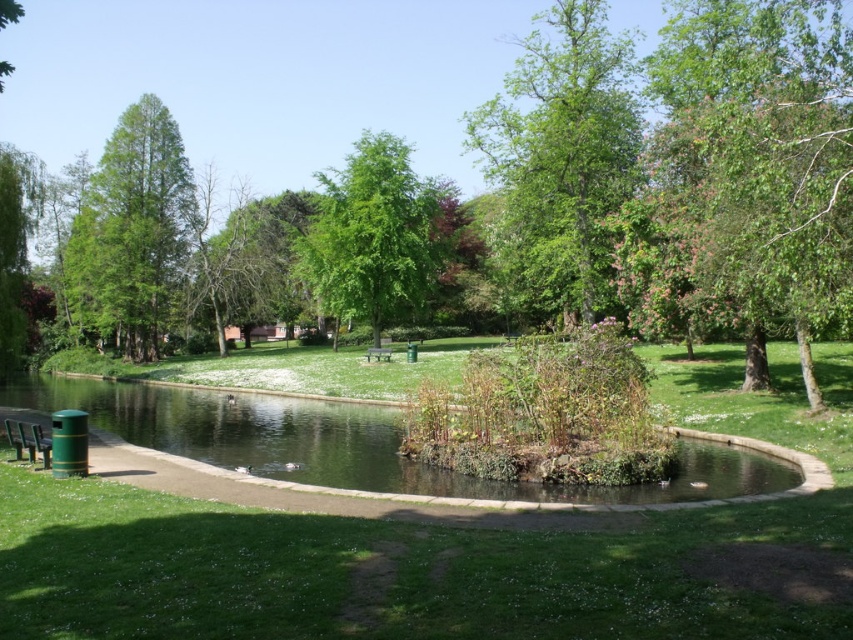
You are standing at the edge of the pond in the park and want to walk towards the point marked as point (810, 176). Which direction should you walk to reach it first, considering there is another point marked as point (436, 276) further away?

Since point (810, 176) is closer to the viewer than point (436, 276), you should walk towards the direction of point (810, 176) to reach it first.

Looking at this image, you are a park visitor sitting on the green painted wood bench at lower left and want to take a photo of the green leafy tree at upper right. Will the bench block your view of the tree?

The green leafy tree at upper right is in front of the green painted wood bench at lower left, so the bench will not block your view of the tree.

You are a park visitor sitting on the green painted wood bench at lower left and want to take a photo of the green leafy tree at upper right. Will the tree be fully visible in your photo without any obstruction?

The green leafy tree at upper right is positioned over the green painted wood bench at lower left, so the tree will be visible but may have some branches or leaves obstructing parts of the photo depending on the angle.